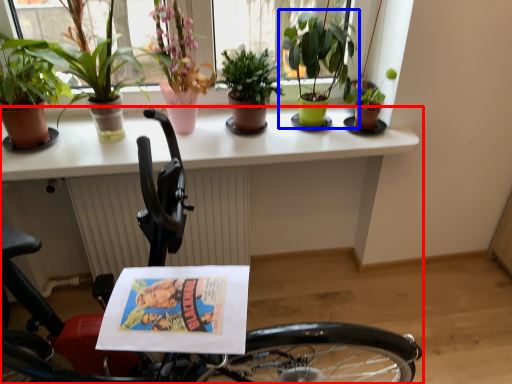
Question: Which point is closer to the camera, bicycle (highlighted by a red box) or houseplant (highlighted by a blue box)?

Choices:
 (A) bicycle
 (B) houseplant

Answer: (A)